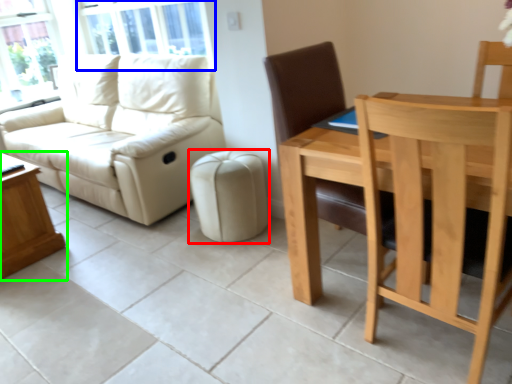
Question: Which object is the closest to the stool (highlighted by a red box)? Choose among these: window screen (highlighted by a blue box) or table (highlighted by a green box).

Choices:
 (A) window screen
 (B) table

Answer: (B)